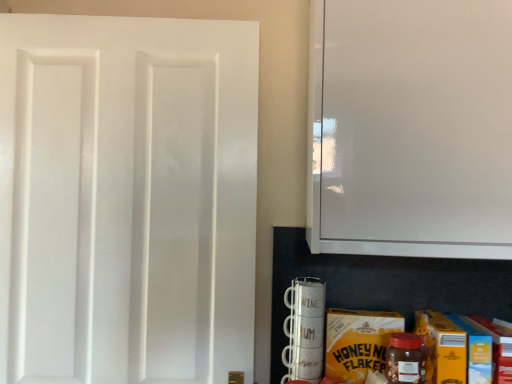
What do you see at coordinates (405, 359) in the screenshot?
I see `translucent plastic jar at lower right` at bounding box center [405, 359].

Locate an element on the screen. yellow cardboard carton at lower right is located at coordinates (358, 342).

Which object is closer to the camera taking this photo, translucent plastic jar at lower right or yellow cardboard carton at lower right?

Positioned in front is translucent plastic jar at lower right.

Looking at this image, which is closer, (419, 381) or (385, 345)?

Point (419, 381) is closer to the camera than point (385, 345).

Considering the sizes of objects translucent plastic jar at lower right and yellow cardboard carton at lower right in the image provided, who is wider, translucent plastic jar at lower right or yellow cardboard carton at lower right?

With larger width is translucent plastic jar at lower right.

Who is more distant, yellow cardboard carton at lower right or white matte door at left?

white matte door at left is further away from the camera.

Considering the points (337, 370) and (215, 42), which point is behind, point (337, 370) or point (215, 42)?

Point (215, 42)

From a real-world perspective, which object stands above the other?

white matte door at left.

Consider the image. From the image's perspective, is yellow cardboard carton at lower right beneath translucent plastic jar at lower right?

Indeed, from the image's perspective, yellow cardboard carton at lower right is shown beneath translucent plastic jar at lower right.

Considering the relative positions of yellow cardboard carton at lower right and translucent plastic jar at lower right in the image provided, is yellow cardboard carton at lower right to the right of translucent plastic jar at lower right from the viewer's perspective?

Incorrect, yellow cardboard carton at lower right is not on the right side of translucent plastic jar at lower right.

From the picture: Could translucent plastic jar at lower right be considered to be inside yellow cardboard carton at lower right?

No, translucent plastic jar at lower right is not inside yellow cardboard carton at lower right.

Which of these two, yellow cardboard carton at lower right or translucent plastic jar at lower right, is wider?

With larger width is translucent plastic jar at lower right.

Considering the relative sizes of white glossy cabinet at upper right and white matte door at left in the image provided, is white glossy cabinet at upper right shorter than white matte door at left?

Yes.

In order to click on door below the white glossy cabinet at upper right (from the image's perspective) in this screenshot , I will do `click(127, 198)`.

From a real-world perspective, is white glossy cabinet at upper right below white matte door at left?

Actually, white glossy cabinet at upper right is physically above white matte door at left in the real world.

Which is farther, (392, 361) or (190, 125)?

The point (190, 125) is behind.

Is translucent plastic jar at lower right thinner than white matte door at left?

No.

Are translucent plastic jar at lower right and white matte door at left located far from each other?

That's not correct — translucent plastic jar at lower right is a little close to white matte door at left.

Is translucent plastic jar at lower right positioned with its back to white matte door at left?

translucent plastic jar at lower right does not have its back to white matte door at left.

Is translucent plastic jar at lower right further to camera compared to white glossy cabinet at upper right?

That is True.

Is white glossy cabinet at upper right a part of translucent plastic jar at lower right?

No, translucent plastic jar at lower right does not contain white glossy cabinet at upper right.

Based on the photo, considering the relative sizes of translucent plastic jar at lower right and white glossy cabinet at upper right in the image provided, is translucent plastic jar at lower right thinner than white glossy cabinet at upper right?

Yes.

Considering the relative sizes of translucent plastic jar at lower right and white glossy cabinet at upper right in the image provided, is translucent plastic jar at lower right smaller than white glossy cabinet at upper right?

Indeed, translucent plastic jar at lower right has a smaller size compared to white glossy cabinet at upper right.

Is yellow cardboard carton at lower right at the back of white glossy cabinet at upper right?

white glossy cabinet at upper right is not turned away from yellow cardboard carton at lower right.

Is white glossy cabinet at upper right at the left side of yellow cardboard carton at lower right?

No, white glossy cabinet at upper right is not to the left of yellow cardboard carton at lower right.

Considering the positions of objects white glossy cabinet at upper right and yellow cardboard carton at lower right in the image provided, who is behind, white glossy cabinet at upper right or yellow cardboard carton at lower right?

Positioned behind is yellow cardboard carton at lower right.

How different are the orientations of white glossy cabinet at upper right and yellow cardboard carton at lower right in degrees?

The facing directions of white glossy cabinet at upper right and yellow cardboard carton at lower right are 0.00396 degrees apart.

Where is `carton below the translucent plastic jar at lower right (from a real-world perspective)`? carton below the translucent plastic jar at lower right (from a real-world perspective) is located at coordinates (358, 342).

The height and width of the screenshot is (384, 512). Find the location of `door positioned vertically above the yellow cardboard carton at lower right (from a real-world perspective)`. door positioned vertically above the yellow cardboard carton at lower right (from a real-world perspective) is located at coordinates (127, 198).

When comparing their distances from translucent plastic jar at lower right, does white matte door at left or yellow cardboard carton at lower right seem further?

white matte door at left is further to translucent plastic jar at lower right.

Based on their spatial positions, is white matte door at left or translucent plastic jar at lower right closer to white glossy cabinet at upper right?

The object closer to white glossy cabinet at upper right is translucent plastic jar at lower right.

Considering their positions, is translucent plastic jar at lower right positioned further to white matte door at left than yellow cardboard carton at lower right?

translucent plastic jar at lower right.

Considering their positions, is yellow cardboard carton at lower right positioned closer to translucent plastic jar at lower right than white glossy cabinet at upper right?

Among the two, yellow cardboard carton at lower right is located nearer to translucent plastic jar at lower right.

Looking at the image, which one is located further to yellow cardboard carton at lower right, white glossy cabinet at upper right or white matte door at left?

Based on the image, white matte door at left appears to be further to yellow cardboard carton at lower right.

From the image, which object appears to be nearer to yellow cardboard carton at lower right, white glossy cabinet at upper right or translucent plastic jar at lower right?

Among the two, translucent plastic jar at lower right is located nearer to yellow cardboard carton at lower right.

Estimate the real-world distances between objects in this image. Which object is further from translucent plastic jar at lower right, white glossy cabinet at upper right or white matte door at left?

Based on the image, white matte door at left appears to be further to translucent plastic jar at lower right.

Which object lies further to the anchor point yellow cardboard carton at lower right, white matte door at left or white glossy cabinet at upper right?

white matte door at left is further to yellow cardboard carton at lower right.

The height and width of the screenshot is (384, 512). I want to click on bottle between white matte door at left and white glossy cabinet at upper right in the horizontal direction, so click(x=405, y=359).

Where is `carton between white matte door at left and white glossy cabinet at upper right in the horizontal direction`? The width and height of the screenshot is (512, 384). carton between white matte door at left and white glossy cabinet at upper right in the horizontal direction is located at coordinates (358, 342).

In order to click on bottle between white glossy cabinet at upper right and yellow cardboard carton at lower right vertically in this screenshot , I will do `click(405, 359)`.

You are a GUI agent. You are given a task and a screenshot of the screen. Output one action in this format:
    pyautogui.click(x=<x>, y=<y>)
    Task: Click on the carton located between white matte door at left and translucent plastic jar at lower right in the left-right direction
    This screenshot has height=384, width=512.
    Given the screenshot: What is the action you would take?
    pyautogui.click(x=358, y=342)